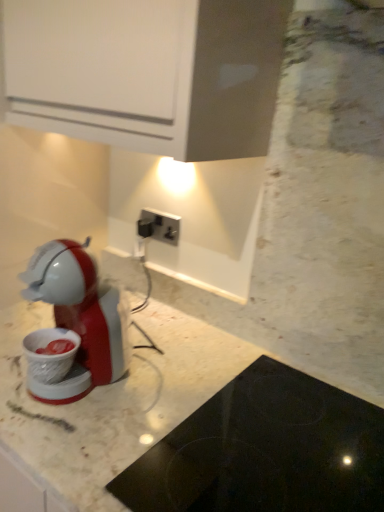
Question: Is black plastic power plugs and sockets at center in front of or behind black glass cooktop at lower center in the image?

Choices:
 (A) front
 (B) behind

Answer: (B)

Question: Is black plastic power plugs and sockets at center inside or outside of black glass cooktop at lower center?

Choices:
 (A) outside
 (B) inside

Answer: (A)

Question: From a real-world perspective, relative to black glass cooktop at lower center, is black plastic power plugs and sockets at center vertically above or below?

Choices:
 (A) below
 (B) above

Answer: (B)

Question: Considering the positions of black glass cooktop at lower center and black plastic power plugs and sockets at center in the image, is black glass cooktop at lower center wider or thinner than black plastic power plugs and sockets at center?

Choices:
 (A) thin
 (B) wide

Answer: (B)

Question: In the image, is black glass cooktop at lower center positioned in front of or behind black plastic power plugs and sockets at center?

Choices:
 (A) front
 (B) behind

Answer: (A)

Question: From a real-world perspective, is black glass cooktop at lower center above or below black plastic power plugs and sockets at center?

Choices:
 (A) below
 (B) above

Answer: (A)

Question: Would you say black glass cooktop at lower center is to the left or to the right of black plastic power plugs and sockets at center in the picture?

Choices:
 (A) left
 (B) right

Answer: (B)